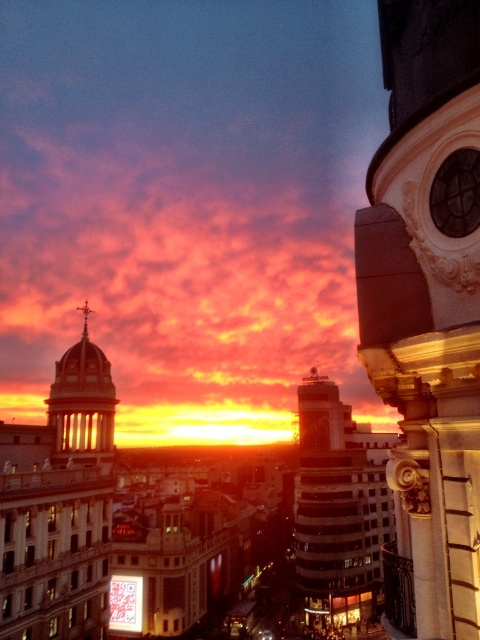
You are standing in the foreground of the urban sunset scene. You notice a point at coordinates (60, 506). What object is located at that point?

The point at coordinates (60, 506) is where the matte gold dome at left is located.

From the picture: You are standing in the urban landscape facing the sunset. There are two points marked in the image. Which point is closer to you, the point at coordinates point (369, 618) or point (72, 401)?

Point (369, 618) is further to the viewer than point (72, 401), so the closer point to you is point (72, 401).